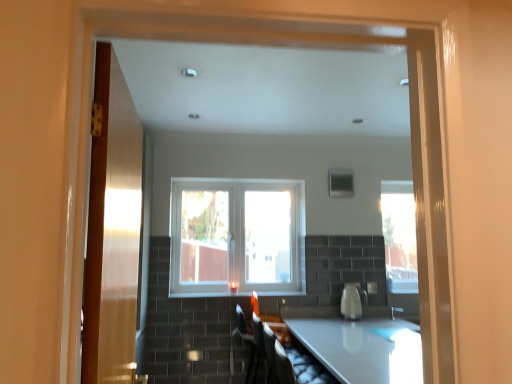
This screenshot has width=512, height=384. Find the location of `vacant area situated below white glossy kettle at center (from a real-world perspective)`. vacant area situated below white glossy kettle at center (from a real-world perspective) is located at coordinates (353, 315).